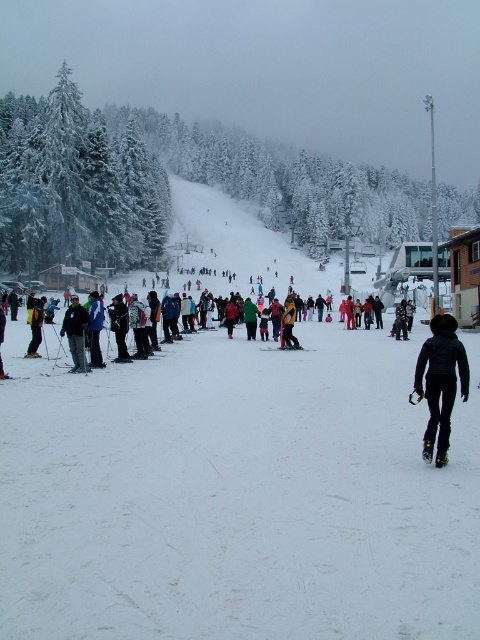
Who is shorter, black matte ski at center or matte black ski at lower left?

matte black ski at lower left

Which is below, black matte ski at center or matte black ski at lower left?

matte black ski at lower left

Describe the element at coordinates (286, 348) in the screenshot. Image resolution: width=480 pixels, height=640 pixels. I see `black matte ski at center` at that location.

Locate an element on the screen. This screenshot has width=480, height=640. black matte ski at center is located at coordinates (286, 348).

Consider the image. Which is below, black matte snowboard at lower right or matte black ski at lower left?

matte black ski at lower left is lower down.

Image resolution: width=480 pixels, height=640 pixels. In order to click on black matte snowboard at lower right in this screenshot , I will do (x=441, y=381).

Can you confirm if dark blue jacket at center is taller than matte yellow jacket at left?

Indeed, dark blue jacket at center has a greater height compared to matte yellow jacket at left.

Is point (85, 314) less distant than point (36, 353)?

Yes.

The height and width of the screenshot is (640, 480). Identify the location of dark blue jacket at center. (75, 333).